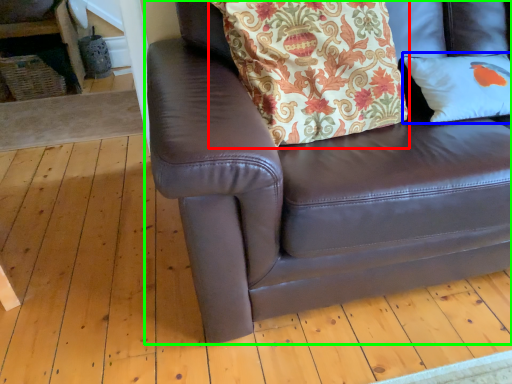
Question: Which is nearer to the blanket (highlighted by a red box)? pillow (highlighted by a blue box) or studio couch (highlighted by a green box).

Choices:
 (A) pillow
 (B) studio couch

Answer: (B)